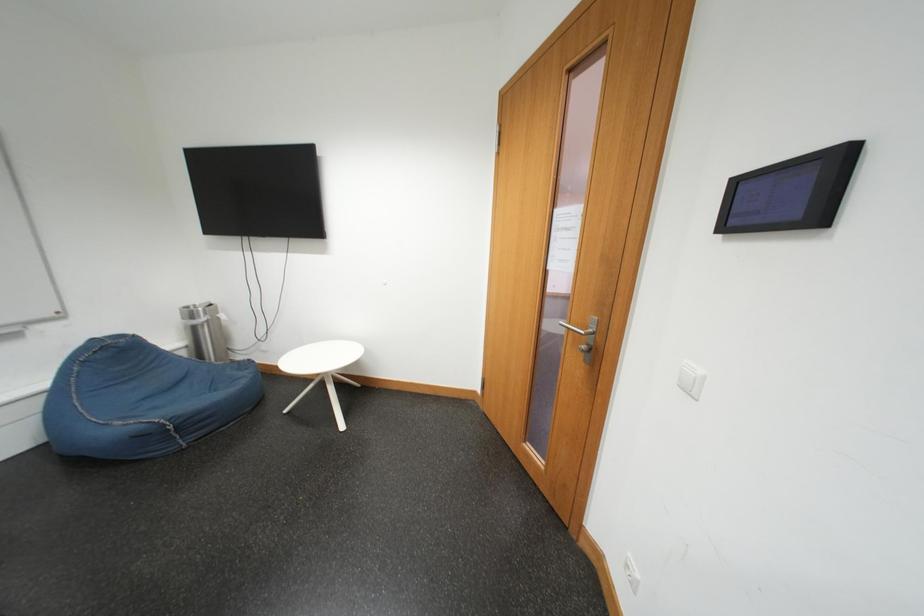
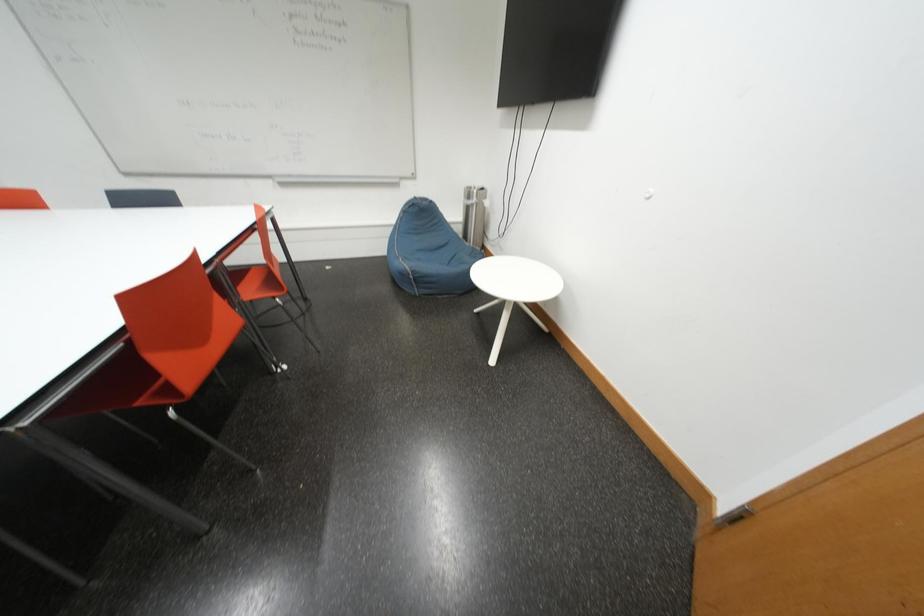
How did the camera likely rotate?

The rotation direction of the camera is left-down.